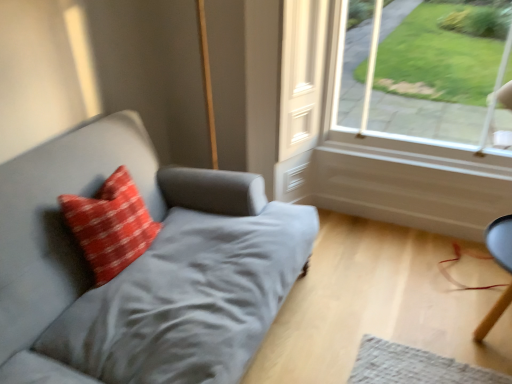
Question: Considering the relative sizes of red textured pillow at left and suede gray couch at left in the image provided, is red textured pillow at left taller than suede gray couch at left?

Choices:
 (A) yes
 (B) no

Answer: (B)

Question: Are red textured pillow at left and suede gray couch at left located far from each other?

Choices:
 (A) yes
 (B) no

Answer: (B)

Question: From the image's perspective, is red textured pillow at left below suede gray couch at left?

Choices:
 (A) no
 (B) yes

Answer: (A)

Question: Is red textured pillow at left completely or partially outside of suede gray couch at left?

Choices:
 (A) yes
 (B) no

Answer: (B)

Question: Can you confirm if red textured pillow at left is bigger than suede gray couch at left?

Choices:
 (A) no
 (B) yes

Answer: (A)

Question: From the image's perspective, is smooth black chair at lower right above or below clear glass window at upper right?

Choices:
 (A) below
 (B) above

Answer: (A)

Question: Looking at their shapes, would you say smooth black chair at lower right is wider or thinner than clear glass window at upper right?

Choices:
 (A) thin
 (B) wide

Answer: (B)

Question: Is smooth black chair at lower right inside the boundaries of clear glass window at upper right, or outside?

Choices:
 (A) inside
 (B) outside

Answer: (B)

Question: In the image, is smooth black chair at lower right on the left side or the right side of clear glass window at upper right?

Choices:
 (A) left
 (B) right

Answer: (B)

Question: From the image's perspective, is suede gray couch at left above or below red textured pillow at left?

Choices:
 (A) above
 (B) below

Answer: (B)

Question: Is suede gray couch at left spatially inside red textured pillow at left, or outside of it?

Choices:
 (A) inside
 (B) outside

Answer: (B)

Question: Considering the positions of suede gray couch at left and red textured pillow at left in the image, is suede gray couch at left taller or shorter than red textured pillow at left?

Choices:
 (A) tall
 (B) short

Answer: (A)

Question: In the image, is suede gray couch at left positioned in front of or behind red textured pillow at left?

Choices:
 (A) front
 (B) behind

Answer: (A)

Question: In terms of width, does smooth black chair at lower right look wider or thinner when compared to red textured pillow at left?

Choices:
 (A) wide
 (B) thin

Answer: (A)

Question: Considering the positions of point (487, 248) and point (142, 218), is point (487, 248) closer or farther from the camera than point (142, 218)?

Choices:
 (A) farther
 (B) closer

Answer: (A)